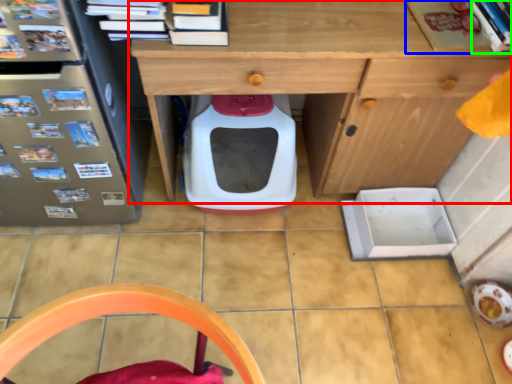
Question: Which object is the farthest from desk (highlighted by a red box)? Choose among these: book (highlighted by a blue box) or book (highlighted by a green box).

Choices:
 (A) book
 (B) book

Answer: (B)